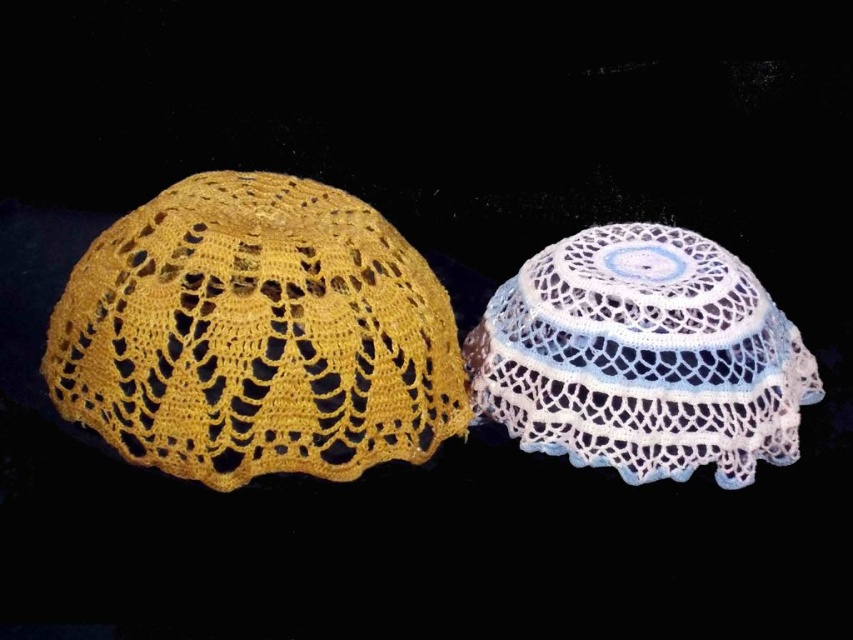
Is yellow crochet bonnet at left to the left of white crochet doily at center from the viewer's perspective?

Indeed, yellow crochet bonnet at left is positioned on the left side of white crochet doily at center.

Who is higher up, yellow crochet bonnet at left or white crochet doily at center?

Positioned higher is yellow crochet bonnet at left.

This screenshot has height=640, width=853. In order to click on yellow crochet bonnet at left in this screenshot , I will do `click(256, 336)`.